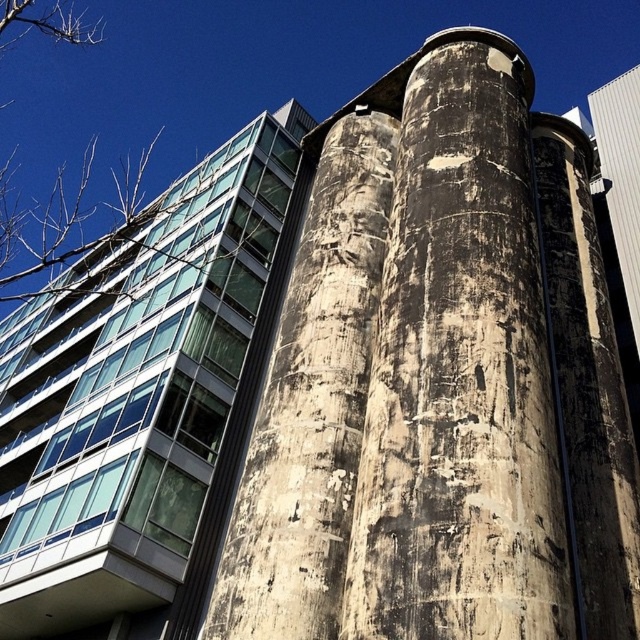
You are a construction worker needing to move a 5 meter long steel beam from the weathered concrete silo at center to the weathered concrete pillar at center. Can the beam fit between them without bending?

The distance between the weathered concrete silo at center and the weathered concrete pillar at center is 5.14 meters. Since the beam is 5 meters long, it can fit between them without bending as the distance is slightly longer than the beam.

You are an architect planning to install a new solar panel array. You need to decide between placing it on the roof of the concrete textured tower at center or the weathered concrete silo at center. Which building would allow the solar panels to be more visible from the street in front?

The concrete textured tower at center would allow the solar panels to be more visible from the street in front because the weathered concrete silo at center is positioned behind it, potentially blocking the view of the silo.